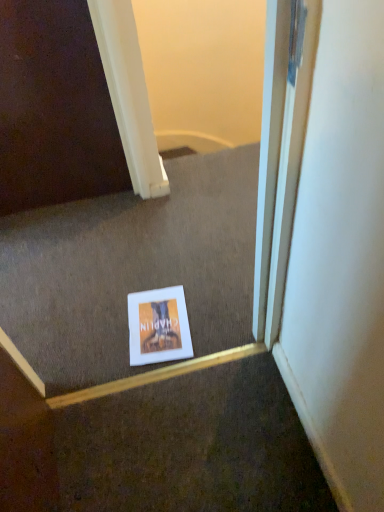
This screenshot has width=384, height=512. I want to click on free spot above white paper at center (from a real-world perspective), so click(137, 265).